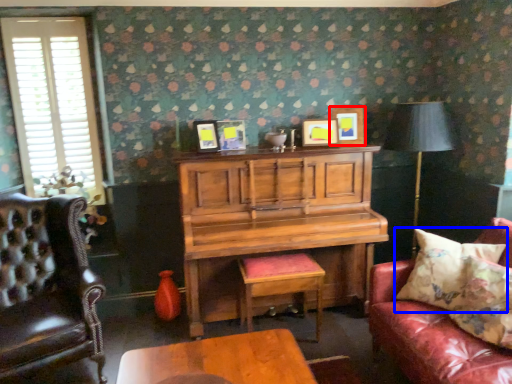
Question: Among these objects, which one is farthest to the camera, picture frame (highlighted by a red box) or pillow (highlighted by a blue box)?

Choices:
 (A) picture frame
 (B) pillow

Answer: (A)